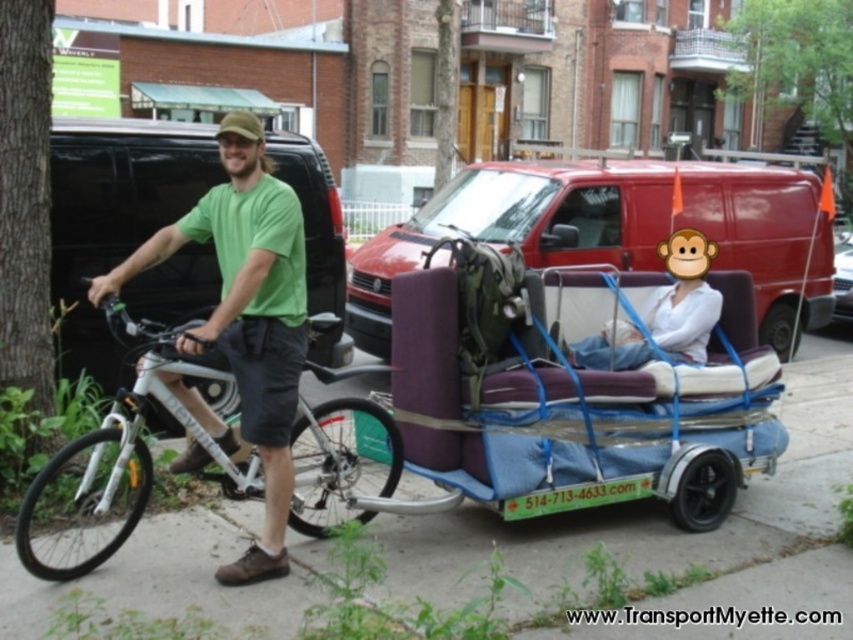
Question: Can you confirm if purple fabric baby carriage at center is thinner than green matte shirt at center?

Choices:
 (A) yes
 (B) no

Answer: (B)

Question: Which point is farther to the camera?

Choices:
 (A) green matte shirt at center
 (B) white matte bicycle at left

Answer: (A)

Question: Which of the following is the closest to the observer?

Choices:
 (A) matte purple couch at center
 (B) metallic silver van at center
 (C) green matte shirt at center

Answer: (C)

Question: Does white matte bicycle at left have a smaller size compared to metallic silver van at center?

Choices:
 (A) no
 (B) yes

Answer: (B)

Question: Which object is positioned closest to the purple fabric baby carriage at center?

Choices:
 (A) metallic silver van at center
 (B) green matte shirt at center
 (C) matte purple couch at center
 (D) white matte bicycle at left

Answer: (D)

Question: Is matte purple couch at center thinner than white matte bicycle at left?

Choices:
 (A) no
 (B) yes

Answer: (B)